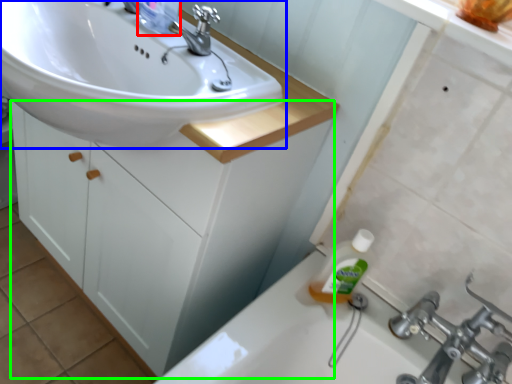
Question: Estimate the real-world distances between objects in this image. Which object is closer to toiletry (highlighted by a red box), sink (highlighted by a blue box) or bathroom cabinet (highlighted by a green box)?

Choices:
 (A) sink
 (B) bathroom cabinet

Answer: (A)